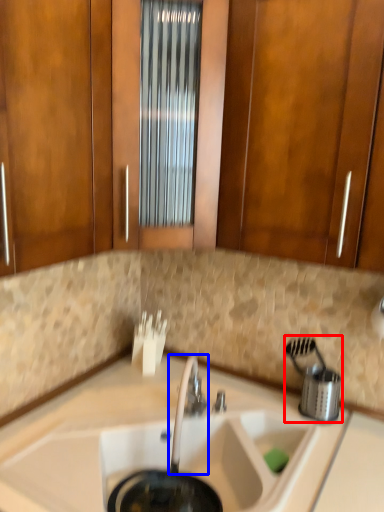
Question: Which object is further to the camera taking this photo, appliance (highlighted by a red box) or tap (highlighted by a blue box)?

Choices:
 (A) appliance
 (B) tap

Answer: (A)